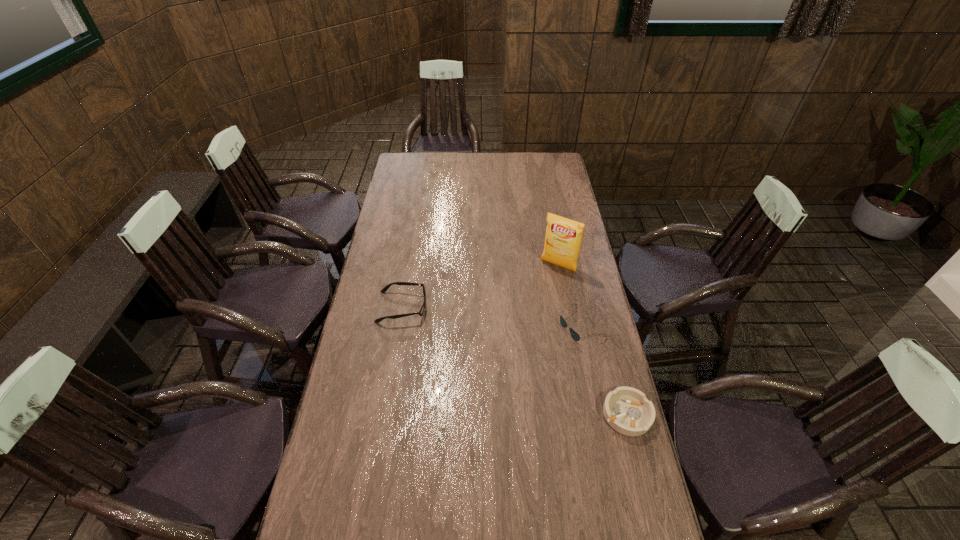
Locate an element on the screen. This screenshot has height=540, width=960. vacant spot on the desktop that is between the leftmost object and the ashtray and is positioned on the lenses of the sunglasses is located at coordinates (511, 359).

Where is `free space on the desktop that is between the leftmost object and the nearest object and is positioned on the front of the crisp (potato chip) with the logo`? free space on the desktop that is between the leftmost object and the nearest object and is positioned on the front of the crisp (potato chip) with the logo is located at coordinates (502, 355).